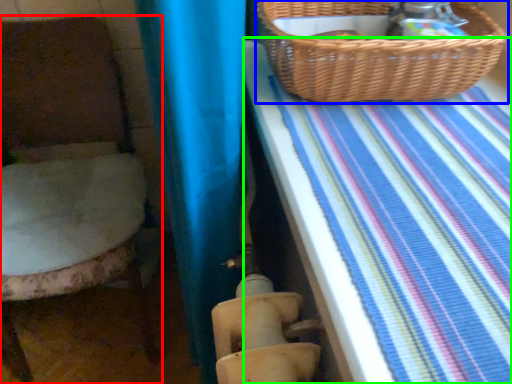
Question: Which object is the closest to the furniture (highlighted by a red box)? Choose among these: picnic basket (highlighted by a blue box) or sheet (highlighted by a green box).

Choices:
 (A) picnic basket
 (B) sheet

Answer: (B)